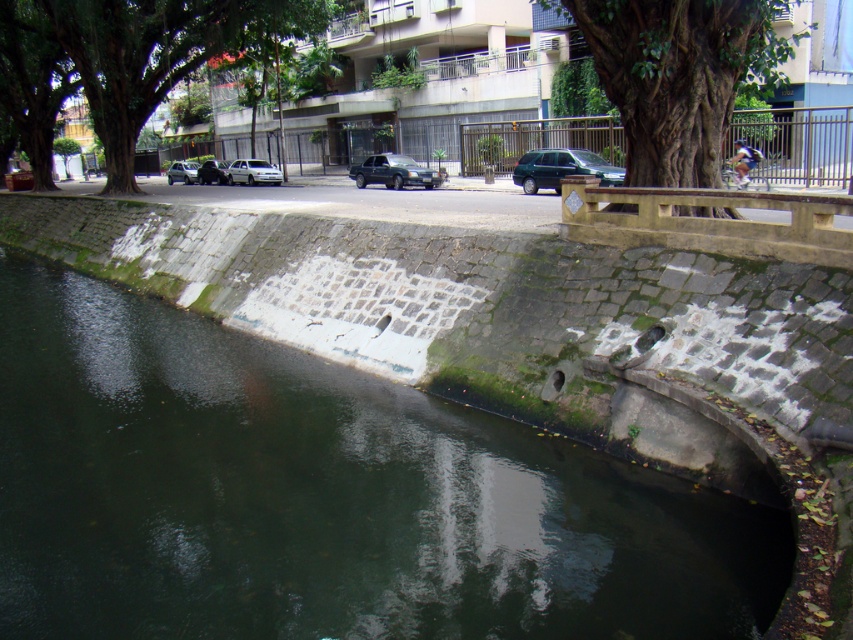
You are a delivery driver who needs to cross the canal to deliver a package. The green stone river at lower left and the shiny silver sedan at center are in your path. Which object is smaller and can be easily navigated around?

The green stone river at lower left is smaller in size compared to the shiny silver sedan at center, so it can be easily navigated around.

You are a pedestrian standing on the sidewalk near the canal. You want to take a photo of the shiny silver sedan at center without including the green leafy tree at upper left in the frame. Is this possible based on their positions?

The green leafy tree at upper left is in front of the shiny silver sedan at center, so it would block the view. To take a photo of the shiny silver sedan at center without the tree, you would need to move to a position where the tree is no longer between you and the sedan.

You are a delivery driver needing to park your truck, which is 2 meters wide, in this area. Looking at the white matte car at center and the silver metallic car at left, which one can you park next to without overlapping? Please explain based on their widths.

The white matte car at center has a lesser width compared to the silver metallic car at left. Since your truck is 2 meters wide, you should park next to the silver metallic car at left, as it has more space available due to its greater width, allowing enough room for the truck.